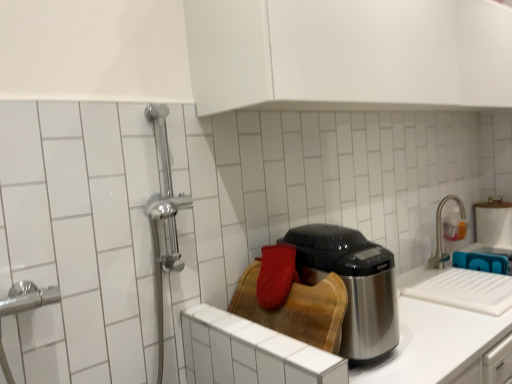
Question: Is satin nickel faucet at upper right turned away from satin steel counter top at center?

Choices:
 (A) yes
 (B) no

Answer: (B)

Question: From the image's perspective, is satin nickel faucet at upper right located beneath satin steel counter top at center?

Choices:
 (A) no
 (B) yes

Answer: (A)

Question: Is satin nickel faucet at upper right directly adjacent to satin steel counter top at center?

Choices:
 (A) yes
 (B) no

Answer: (B)

Question: Can you confirm if satin nickel faucet at upper right is positioned to the right of satin steel counter top at center?

Choices:
 (A) no
 (B) yes

Answer: (B)

Question: Is satin nickel faucet at upper right not inside satin steel counter top at center?

Choices:
 (A) yes
 (B) no

Answer: (A)

Question: Does satin nickel faucet at upper right lie in front of satin steel counter top at center?

Choices:
 (A) no
 (B) yes

Answer: (A)

Question: Would you say satin steel counter top at center is outside shiny metallic appliance at center?

Choices:
 (A) yes
 (B) no

Answer: (A)

Question: Considering the relative positions of satin steel counter top at center and shiny metallic appliance at center in the image provided, is satin steel counter top at center to the left of shiny metallic appliance at center from the viewer's perspective?

Choices:
 (A) no
 (B) yes

Answer: (A)

Question: Is satin steel counter top at center bigger than shiny metallic appliance at center?

Choices:
 (A) no
 (B) yes

Answer: (B)

Question: Does satin steel counter top at center have a lesser width compared to shiny metallic appliance at center?

Choices:
 (A) yes
 (B) no

Answer: (B)

Question: Can you confirm if satin steel counter top at center is positioned to the right of shiny metallic appliance at center?

Choices:
 (A) yes
 (B) no

Answer: (A)

Question: Is shiny metallic appliance at center a part of satin steel counter top at center?

Choices:
 (A) no
 (B) yes

Answer: (A)

Question: Is shiny metallic appliance at center bigger than satin nickel faucet at upper right?

Choices:
 (A) yes
 (B) no

Answer: (A)